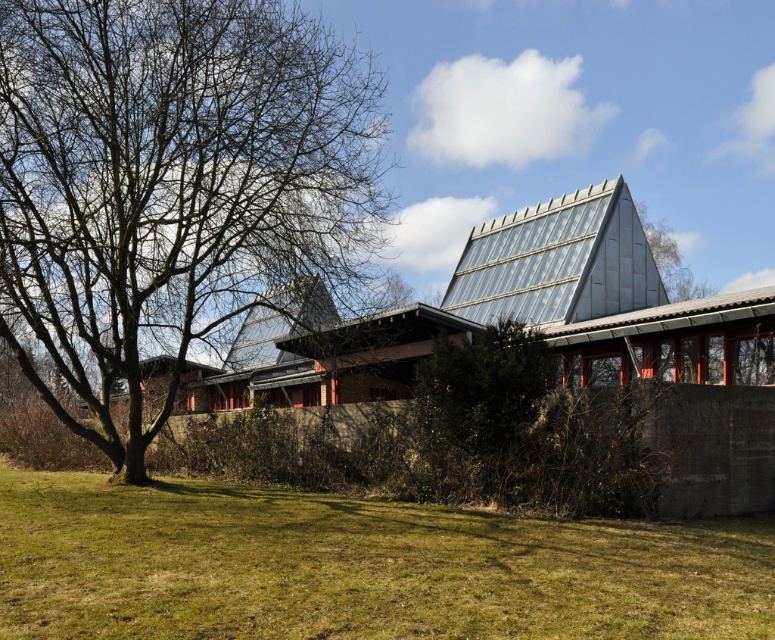
Question: Which of the following is the farthest from the observer?

Choices:
 (A) green leafy tree at upper center
 (B) bare wood tree at left
 (C) green grass at lower center
 (D) green leafy bush at center

Answer: (A)

Question: Can you confirm if bare wood tree at left is thinner than green leafy tree at upper center?

Choices:
 (A) yes
 (B) no

Answer: (B)

Question: Among these objects, which one is nearest to the camera?

Choices:
 (A) bare wood tree at left
 (B) green grass at lower center

Answer: (B)

Question: Which object is positioned closest to the bare wood tree at left?

Choices:
 (A) green leafy tree at upper center
 (B) green leafy bush at center
 (C) green grass at lower center

Answer: (C)

Question: Is bare wood tree at left in front of green leafy bush at center?

Choices:
 (A) yes
 (B) no

Answer: (B)

Question: Is bare wood tree at left above green leafy bush at center?

Choices:
 (A) no
 (B) yes

Answer: (B)